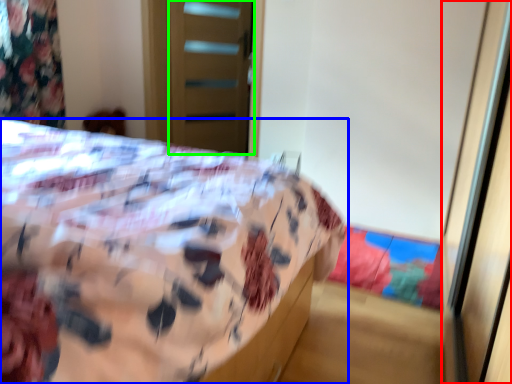
Question: Which is nearer to the screen door (highlighted by a red box)? bed (highlighted by a blue box) or screen door (highlighted by a green box).

Choices:
 (A) bed
 (B) screen door

Answer: (A)